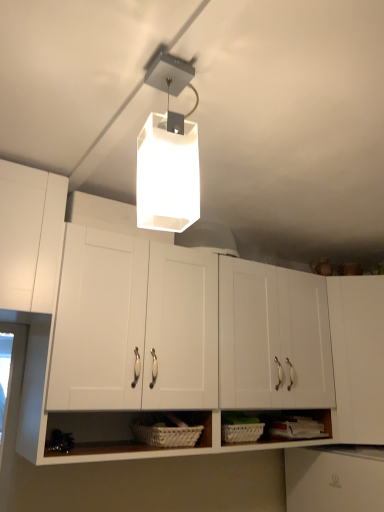
Question: Considering the relative positions of white matte rectangular light fixture at upper center and white woven basket at lower center in the image provided, is white matte rectangular light fixture at upper center to the left of white woven basket at lower center from the viewer's perspective?

Choices:
 (A) no
 (B) yes

Answer: (A)

Question: Does white matte rectangular light fixture at upper center come behind white woven basket at lower center?

Choices:
 (A) no
 (B) yes

Answer: (A)

Question: Is white matte rectangular light fixture at upper center looking in the opposite direction of white woven basket at lower center?

Choices:
 (A) no
 (B) yes

Answer: (A)

Question: Does white matte rectangular light fixture at upper center have a larger size compared to white woven basket at lower center?

Choices:
 (A) yes
 (B) no

Answer: (A)

Question: Is the position of white matte rectangular light fixture at upper center less distant than that of white woven basket at lower center?

Choices:
 (A) no
 (B) yes

Answer: (B)

Question: Is white matte cabinet at center, placed as the 1th cabinetry when sorted from left to right, in front of or behind white matte rectangular light fixture at upper center in the image?

Choices:
 (A) front
 (B) behind

Answer: (B)

Question: Is point (107, 245) closer or farther from the camera than point (152, 146)?

Choices:
 (A) farther
 (B) closer

Answer: (A)

Question: Is white matte cabinet at center, placed as the 1th cabinetry when sorted from left to right, situated inside white matte rectangular light fixture at upper center or outside?

Choices:
 (A) outside
 (B) inside

Answer: (A)

Question: From the image's perspective, is white matte cabinet at center, the second cabinetry viewed from the right, positioned above or below white matte rectangular light fixture at upper center?

Choices:
 (A) below
 (B) above

Answer: (A)

Question: From a real-world perspective, is white matte cabinet at center, placed as the 1th cabinetry when sorted from left to right, physically located above or below white matte cabinet at right, positioned as the 2th cabinetry in left-to-right order?

Choices:
 (A) below
 (B) above

Answer: (B)

Question: Considering the positions of white matte cabinet at center, placed as the 1th cabinetry when sorted from left to right, and white matte cabinet at right, marked as the 1th cabinetry in a right-to-left arrangement, in the image, is white matte cabinet at center, placed as the 1th cabinetry when sorted from left to right, wider or thinner than white matte cabinet at right, marked as the 1th cabinetry in a right-to-left arrangement,?

Choices:
 (A) thin
 (B) wide

Answer: (B)

Question: Relative to white matte cabinet at right, positioned as the 2th cabinetry in left-to-right order, is white matte cabinet at center, the second cabinetry viewed from the right, in front or behind?

Choices:
 (A) behind
 (B) front

Answer: (B)

Question: Is white matte cabinet at center, the second cabinetry viewed from the right, taller or shorter than white matte cabinet at right, marked as the 1th cabinetry in a right-to-left arrangement?

Choices:
 (A) short
 (B) tall

Answer: (B)

Question: Considering the positions of white matte rectangular light fixture at upper center and white matte cabinet at center, the second cabinetry viewed from the right, in the image, is white matte rectangular light fixture at upper center wider or thinner than white matte cabinet at center, the second cabinetry viewed from the right,?

Choices:
 (A) thin
 (B) wide

Answer: (A)

Question: Does point (170, 121) appear closer or farther from the camera than point (198, 370)?

Choices:
 (A) farther
 (B) closer

Answer: (B)